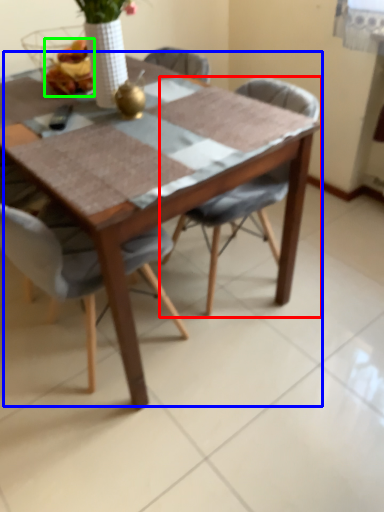
Question: Based on their relative distances, which object is nearer to chair (highlighted by a red box)? Choose from table (highlighted by a blue box) and food (highlighted by a green box).

Choices:
 (A) table
 (B) food

Answer: (A)